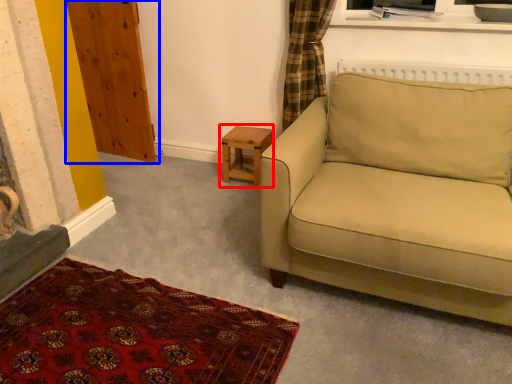
Question: Among these objects, which one is nearest to the camera, table (highlighted by a red box) or armoire (highlighted by a blue box)?

Choices:
 (A) table
 (B) armoire

Answer: (B)